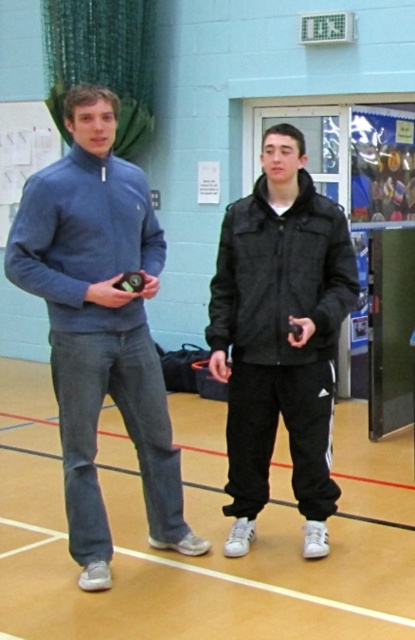
Can you confirm if blue fleece sweater at left is positioned below black matte jacket at center?

No, blue fleece sweater at left is not below black matte jacket at center.

Who is positioned more to the right, blue fleece sweater at left or black matte jacket at center?

black matte jacket at center

Measure the distance between point (99,502) and camera.

They are 4.11 meters apart.

Where is `blue fleece sweater at left`? Image resolution: width=415 pixels, height=640 pixels. blue fleece sweater at left is located at coordinates (100, 324).